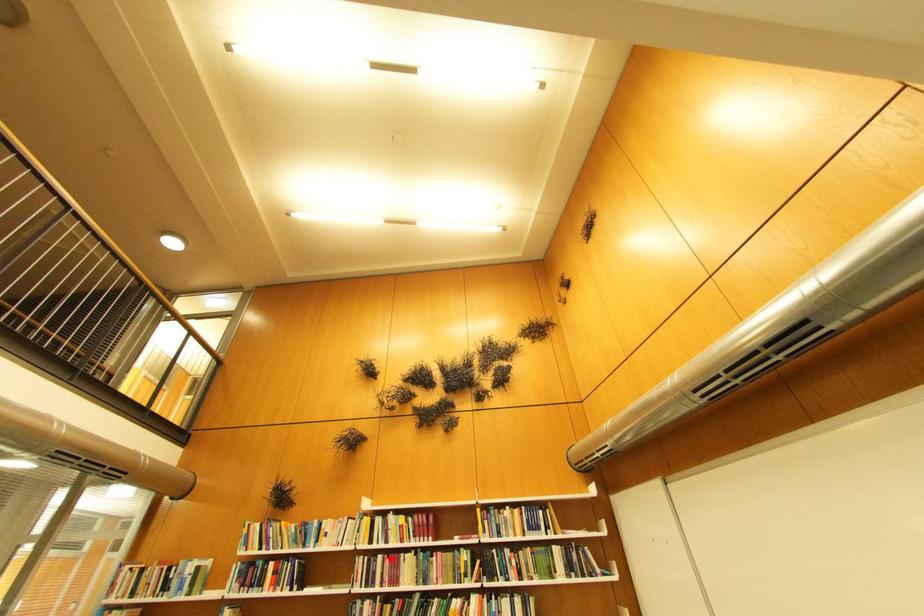
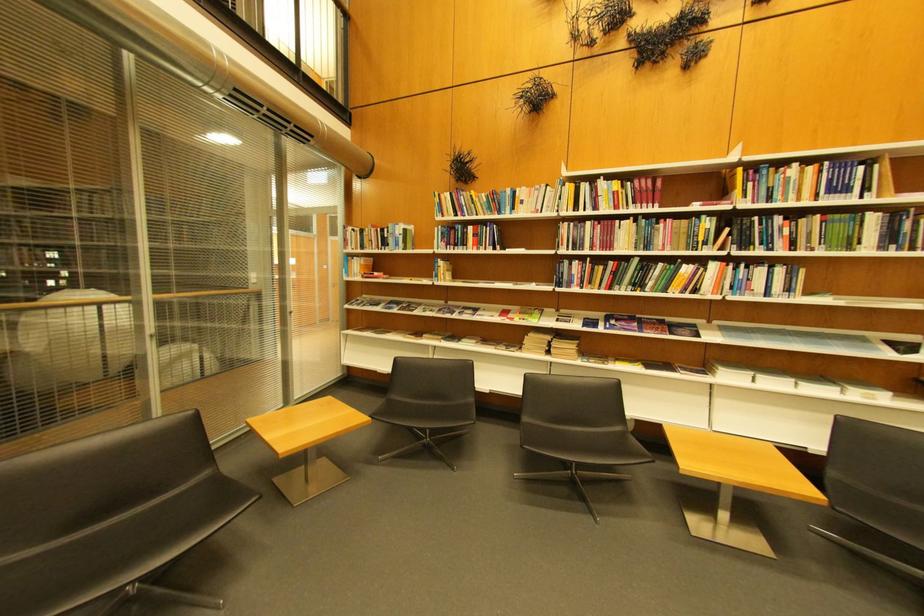
Where in the second image is the point corresponding to the highlighted location from the first image?

(600, 225)